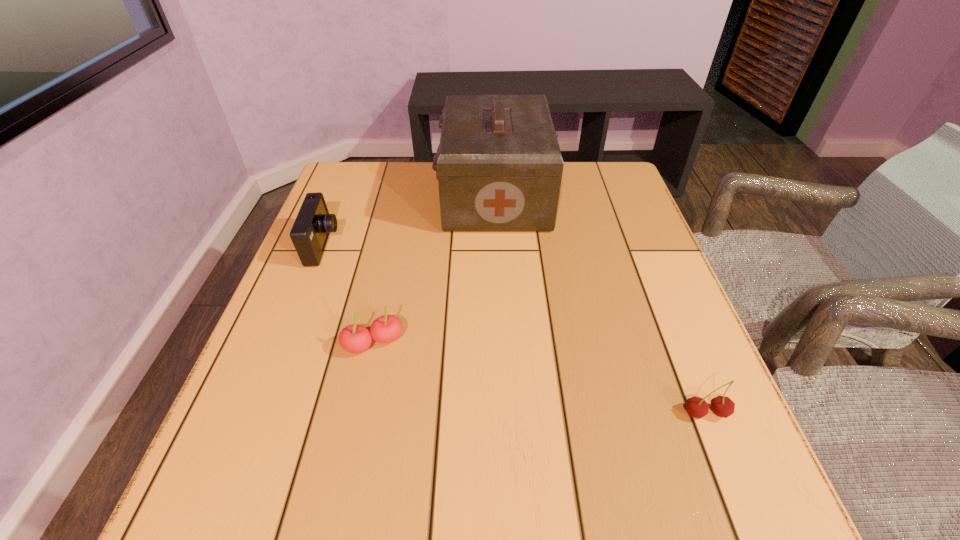
Find the location of a particular element. The width and height of the screenshot is (960, 540). free space located on the back of the farther cherry is located at coordinates (397, 234).

Locate an element on the screen. object present at the far edge is located at coordinates (499, 167).

This screenshot has height=540, width=960. Identify the location of camera that is positioned at the left edge. (310, 232).

Where is `cherry that is at the left edge`? cherry that is at the left edge is located at coordinates (355, 339).

This screenshot has height=540, width=960. Identify the location of object present at the right edge. click(x=722, y=406).

Image resolution: width=960 pixels, height=540 pixels. In the image, there is a desktop. What are the coordinates of `free space at the far edge` in the screenshot? It's located at [x=396, y=197].

The width and height of the screenshot is (960, 540). Identify the location of vacant area at the near edge. (329, 494).

In the image, there is a desktop. Where is `vacant space at the left edge`? Image resolution: width=960 pixels, height=540 pixels. vacant space at the left edge is located at coordinates (356, 221).

The height and width of the screenshot is (540, 960). I want to click on vacant space at the right edge of the desktop, so click(605, 252).

Where is `vacant space at the far left corner of the desktop`? This screenshot has height=540, width=960. vacant space at the far left corner of the desktop is located at coordinates (369, 162).